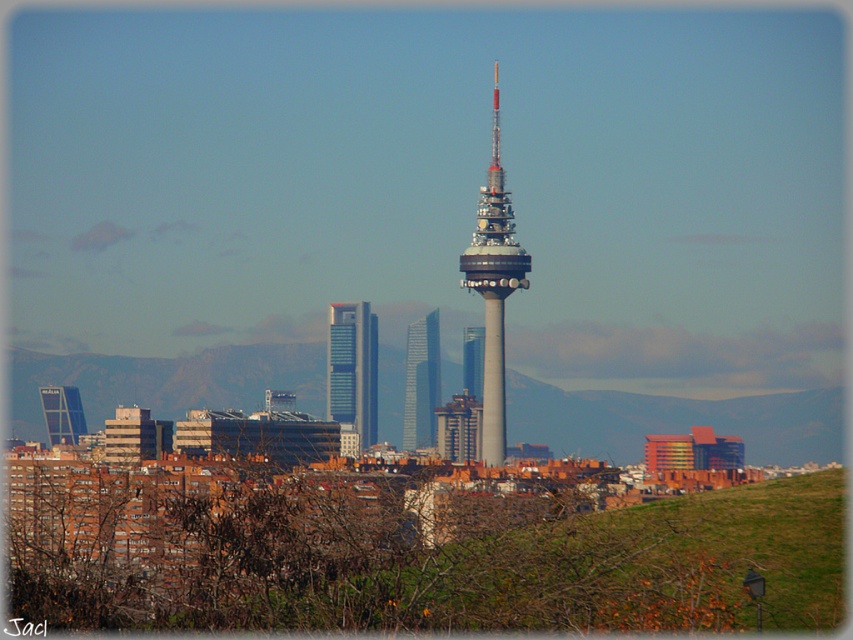
Can you confirm if gray metallic tower at center is bigger than sleek glass skyscraper at center?

Indeed, gray metallic tower at center has a larger size compared to sleek glass skyscraper at center.

Is point (494, 310) more distant than point (479, 355)?

Yes.

What do you see at coordinates (494, 285) in the screenshot? The width and height of the screenshot is (853, 640). I see `gray metallic tower at center` at bounding box center [494, 285].

Identify the location of gray metallic tower at center. (494, 285).

Measure the distance between smooth glass skyscraper at center and camera.

647.19 meters

Is smooth glass skyscraper at center positioned in front of matte glass skyscraper at center?

Yes, smooth glass skyscraper at center is closer to the viewer.

Where is `smooth glass skyscraper at center`? smooth glass skyscraper at center is located at coordinates tap(421, 381).

Find the location of a particular element. smooth glass skyscraper at center is located at coordinates (421, 381).

Does silver glass skyscraper at center have a lesser width compared to matte glass skyscraper at center?

Yes, silver glass skyscraper at center is thinner than matte glass skyscraper at center.

Who is lower down, silver glass skyscraper at center or matte glass skyscraper at center?

matte glass skyscraper at center is lower down.

Does point (355, 417) come in front of point (61, 388)?

Yes, it is.

Identify the location of silver glass skyscraper at center. Image resolution: width=853 pixels, height=640 pixels. (x=352, y=369).